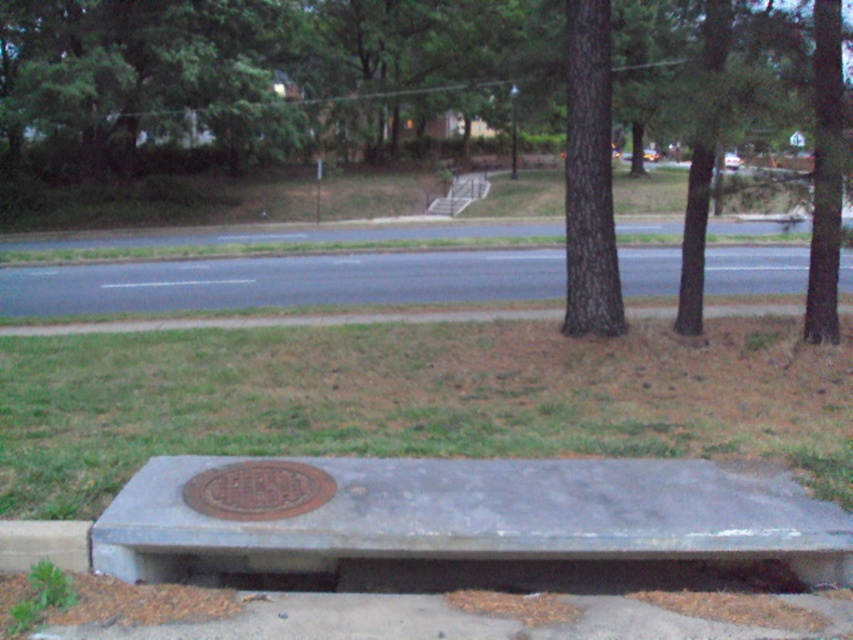
Does green grass at lower center lie behind smooth concrete bench at center?

Yes, it is behind smooth concrete bench at center.

Who is more forward, [688,422] or [340,531]?

Point [340,531]

Is point (248, 346) positioned after point (332, 545)?

Yes, it is.

Locate an element on the screen. This screenshot has width=853, height=640. green grass at lower center is located at coordinates (412, 400).

Can you confirm if green grass at lower center is shorter than rusty metal manhole cover at center?

No, green grass at lower center is not shorter than rusty metal manhole cover at center.

This screenshot has width=853, height=640. Describe the element at coordinates (412, 400) in the screenshot. I see `green grass at lower center` at that location.

Does point (413, 412) lie behind point (219, 513)?

Yes, it is behind point (219, 513).

Where is `green grass at lower center`? The image size is (853, 640). green grass at lower center is located at coordinates pos(412,400).

Does brown textured tree at center have a lesser width compared to gray concrete curb at lower left?

Incorrect, brown textured tree at center's width is not less than gray concrete curb at lower left's.

Is brown textured tree at center positioned in front of gray concrete curb at lower left?

That is False.

Find the location of a particular element. This screenshot has height=640, width=853. brown textured tree at center is located at coordinates (428, 90).

Where is `brown textured tree at center`? The width and height of the screenshot is (853, 640). brown textured tree at center is located at coordinates (428, 90).